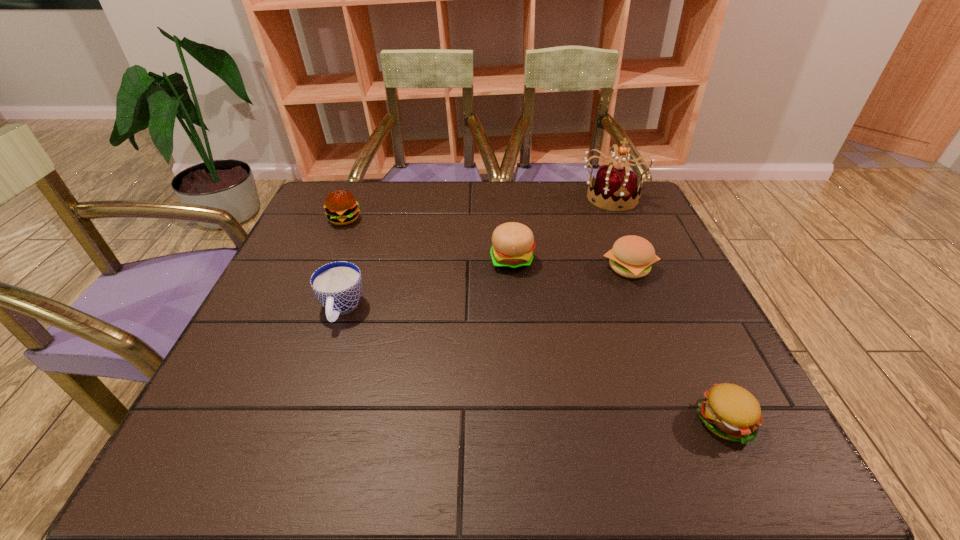
Identify the location of empty space that is in between the third object from left to right and the nearest object. This screenshot has width=960, height=540. (619, 341).

Where is `free space between the farthest hamburger and the tiara`? Image resolution: width=960 pixels, height=540 pixels. free space between the farthest hamburger and the tiara is located at coordinates (478, 208).

Identify which object is the second closest to the nearest object. Please provide its 2D coordinates. Your answer should be formatted as a tuple, i.e. [(x, y)], where the tuple contains the x and y coordinates of a point satisfying the conditions above.

[(513, 243)]

Locate which object ranks fifth in proximity to the leftmost hamburger. Please provide its 2D coordinates. Your answer should be formatted as a tuple, i.e. [(x, y)], where the tuple contains the x and y coordinates of a point satisfying the conditions above.

[(729, 411)]

Identify the location of hamburger that is the third closest to the tiara. The width and height of the screenshot is (960, 540). (729, 411).

At what (x,y) coordinates should I click in order to perform the action: click on the third closest hamburger relative to the shortest hamburger. Please return your answer as a coordinate pair (x, y). Looking at the image, I should click on (341, 207).

At what (x,y) coordinates should I click in order to perform the action: click on vacant region that satisfies the following two spatial constraints: 1. on the front side of the farthest hamburger; 2. on the right side of the nearest object. Please return your answer as a coordinate pair (x, y). The image size is (960, 540). Looking at the image, I should click on (261, 421).

You are a GUI agent. You are given a task and a screenshot of the screen. Output one action in this format:
    pyautogui.click(x=<x>, y=<y>)
    Task: Click on the free location that satisfies the following two spatial constraints: 1. on the front-facing side of the nearest hamburger; 2. on the right side of the tiara
    Image resolution: width=960 pixels, height=540 pixels.
    Given the screenshot: What is the action you would take?
    pyautogui.click(x=708, y=421)